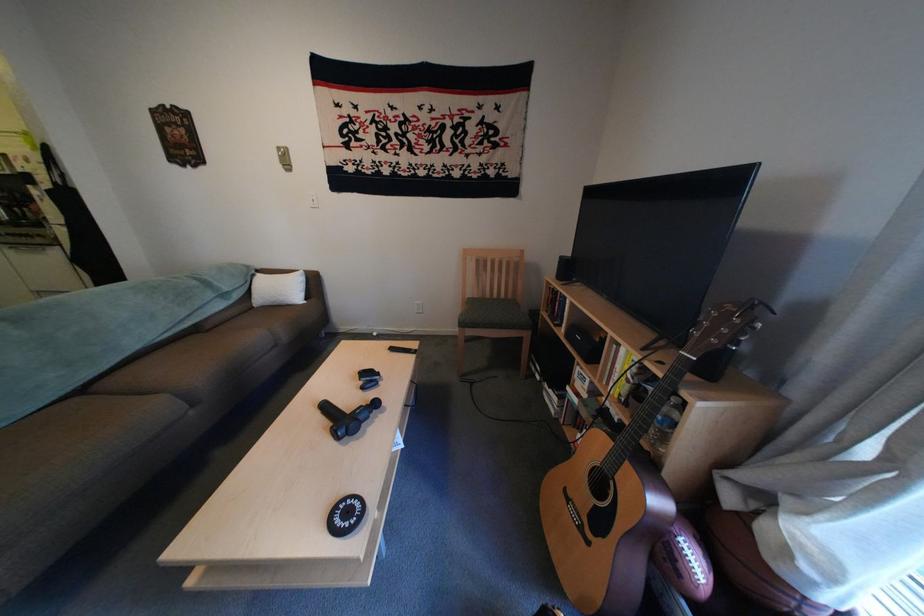
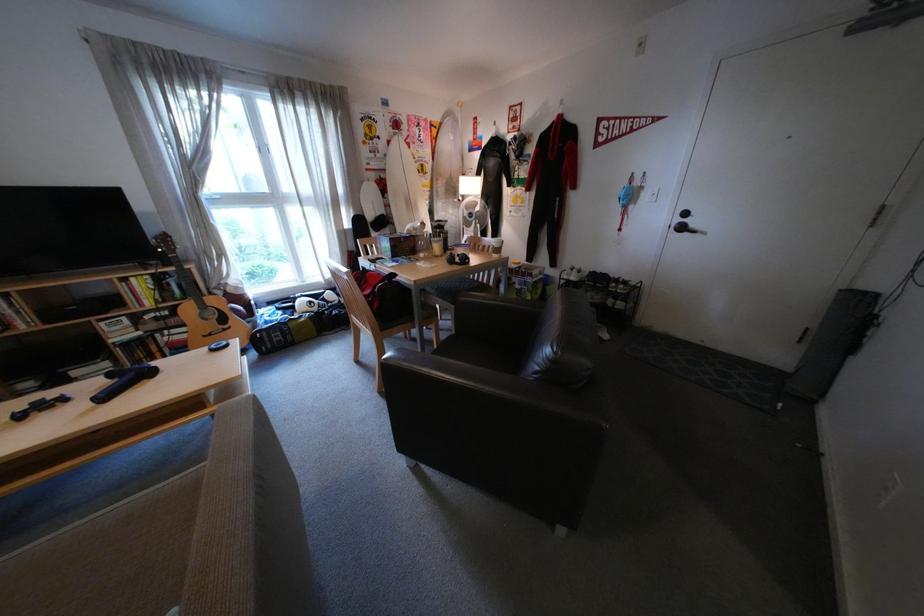
Find the pixel in the second image that matches (570,406) in the first image.

(126, 367)